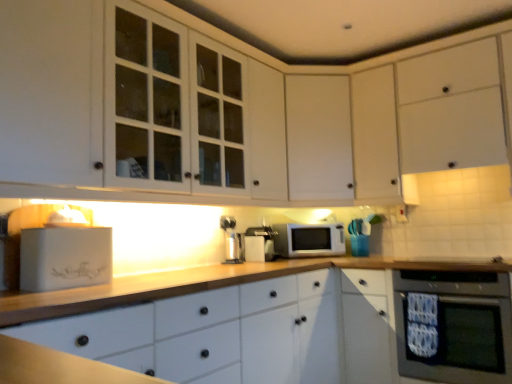
In order to click on satin silver coffee machine at center, which is the first coffee machine in left-to-right order in this screenshot , I will do `click(231, 240)`.

Where is `white glossy cabinet at upper left, which is counted as the first cabinetry, starting from the left`? This screenshot has width=512, height=384. white glossy cabinet at upper left, which is counted as the first cabinetry, starting from the left is located at coordinates (234, 112).

Locate an element on the screen. white matte cabinet at center, which is counted as the third cabinetry, starting from the left is located at coordinates (318, 137).

Where is `microwave oven behind the satin silver coffee machine at center, which is the second coffee machine in left-to-right order`? This screenshot has width=512, height=384. microwave oven behind the satin silver coffee machine at center, which is the second coffee machine in left-to-right order is located at coordinates point(309,240).

Which is less distant, (x=269, y=231) or (x=316, y=252)?

Positioned in front is point (x=316, y=252).

Is satin silver coffee machine at center, which is the second coffee machine in left-to-right order, not inside white matte microwave at center?

satin silver coffee machine at center, which is the second coffee machine in left-to-right order, is positioned outside white matte microwave at center.

Does satin silver coffee machine at center, which is the second coffee machine in left-to-right order, turn towards white matte microwave at center?

No, satin silver coffee machine at center, which is the second coffee machine in left-to-right order, is not turned towards white matte microwave at center.

Could black glass oven at lower right be considered to be inside satin silver coffee machine at center, the first coffee machine when ordered from right to left?

No, satin silver coffee machine at center, the first coffee machine when ordered from right to left, does not contain black glass oven at lower right.

From a real-world perspective, who is located higher, satin silver coffee machine at center, which is the second coffee machine in left-to-right order, or black glass oven at lower right?

satin silver coffee machine at center, which is the second coffee machine in left-to-right order, from a real-world perspective.

Which is nearer, (267,226) or (504,362)?

Point (267,226) is positioned farther from the camera compared to point (504,362).

From the image's perspective, is satin silver coffee machine at center, which is the second coffee machine in left-to-right order, located beneath black glass oven at lower right?

Incorrect, from the image's perspective, satin silver coffee machine at center, which is the second coffee machine in left-to-right order, is higher than black glass oven at lower right.

Is white matte cabinet at center, which is counted as the third cabinetry, starting from the left, beside white matte microwave at center?

white matte cabinet at center, which is counted as the third cabinetry, starting from the left, and white matte microwave at center are not in contact.

Which of these two, white matte cabinet at center, the 2th cabinetry from the right, or white matte microwave at center, is bigger?

Bigger between the two is white matte cabinet at center, the 2th cabinetry from the right.

Is white matte cabinet at center, which is counted as the third cabinetry, starting from the left, positioned with its back to white matte microwave at center?

white matte cabinet at center, which is counted as the third cabinetry, starting from the left, is not turned away from white matte microwave at center.

Is satin silver coffee machine at center, the first coffee machine when ordered from right to left, behind white matte cabinet at upper right, the fourth cabinetry in the left-to-right sequence?

Yes, satin silver coffee machine at center, the first coffee machine when ordered from right to left, is further from the viewer.

Considering the sizes of objects satin silver coffee machine at center, which is the second coffee machine in left-to-right order, and white matte cabinet at upper right, which is counted as the first cabinetry, starting from the right, in the image provided, who is wider, satin silver coffee machine at center, which is the second coffee machine in left-to-right order, or white matte cabinet at upper right, which is counted as the first cabinetry, starting from the right,?

white matte cabinet at upper right, which is counted as the first cabinetry, starting from the right.

What's the angular difference between white matte cabinet at center, the 2th cabinetry from the right, and white matte bread bin at left's facing directions?

There is a 48.1-degree angle between the facing directions of white matte cabinet at center, the 2th cabinetry from the right, and white matte bread bin at left.

Considering the sizes of objects white matte cabinet at center, the 2th cabinetry from the right, and white matte bread bin at left in the image provided, who is wider, white matte cabinet at center, the 2th cabinetry from the right, or white matte bread bin at left?

white matte cabinet at center, the 2th cabinetry from the right.

Is white matte cabinet at center, the 2th cabinetry from the right, aimed at white matte bread bin at left?

No.

Which is more to the left, white matte cabinet at center, the 2th cabinetry from the right, or white matte bread bin at left?

white matte bread bin at left is more to the left.

Which of these two, satin silver coffee machine at center, which is the second coffee machine in left-to-right order, or white matte cabinet at center, which is counted as the third cabinetry, starting from the left, is wider?

white matte cabinet at center, which is counted as the third cabinetry, starting from the left.

Which object is positioned more to the right, satin silver coffee machine at center, which is the second coffee machine in left-to-right order, or white matte cabinet at center, the 2th cabinetry from the right?

From the viewer's perspective, white matte cabinet at center, the 2th cabinetry from the right, appears more on the right side.

How distant is satin silver coffee machine at center, which is the second coffee machine in left-to-right order, from white matte cabinet at center, the 2th cabinetry from the right?

The distance of satin silver coffee machine at center, which is the second coffee machine in left-to-right order, from white matte cabinet at center, the 2th cabinetry from the right, is 26.77 inches.

Is satin silver coffee machine at center, which is the second coffee machine in left-to-right order, outside of white matte cabinet at center, the 2th cabinetry from the right?

Absolutely, satin silver coffee machine at center, which is the second coffee machine in left-to-right order, is external to white matte cabinet at center, the 2th cabinetry from the right.

Between white glossy cabinet at upper left, which ranks as the 4th cabinetry in right-to-left order, and white matte microwave at center, which one has less height?

Standing shorter between the two is white matte microwave at center.

Is white glossy cabinet at upper left, which is counted as the first cabinetry, starting from the left, positioned with its back to white matte microwave at center?

No, white matte microwave at center is not at the back of white glossy cabinet at upper left, which is counted as the first cabinetry, starting from the left.

Measure the distance between white glossy cabinet at upper left, which is counted as the first cabinetry, starting from the left, and white matte microwave at center.

The distance of white glossy cabinet at upper left, which is counted as the first cabinetry, starting from the left, from white matte microwave at center is 31.97 inches.

Which object is thinner, white glossy cabinet at upper left, which ranks as the 4th cabinetry in right-to-left order, or white matte microwave at center?

white matte microwave at center is thinner.

Locate an element on the screen. microwave oven on the right of satin silver coffee machine at center, which is the second coffee machine in left-to-right order is located at coordinates (309, 240).

Find the location of a particular element. The image size is (512, 384). home appliance below the satin silver coffee machine at center, the first coffee machine when ordered from right to left (from a real-world perspective) is located at coordinates (453, 326).

When comparing their distances from white matte bread bin at left, does satin silver coffee machine at center, arranged as the 2th coffee machine when viewed from the right, or white matte cabinet at upper right, the fourth cabinetry in the left-to-right sequence, seem further?

white matte cabinet at upper right, the fourth cabinetry in the left-to-right sequence.

From the image, which object appears to be farther from white plastic electric outlet at upper right, white matte bread bin at left or satin silver coffee machine at center, the first coffee machine when ordered from right to left?

white matte bread bin at left is further to white plastic electric outlet at upper right.

Looking at this image, estimate the real-world distances between objects in this image. Which object is further from white matte cabinet at upper right, which is counted as the first cabinetry, starting from the right, white matte bread bin at left or satin silver coffee machine at center, which is the second coffee machine in left-to-right order?

The object further to white matte cabinet at upper right, which is counted as the first cabinetry, starting from the right, is white matte bread bin at left.

Considering their positions, is black glass oven at lower right positioned further to white glossy cabinet at upper left, which ranks as the 4th cabinetry in right-to-left order, than white matte bread bin at left?

The object further to white glossy cabinet at upper left, which ranks as the 4th cabinetry in right-to-left order, is black glass oven at lower right.

When comparing their distances from white glossy cabinet at upper left, which is counted as the first cabinetry, starting from the left, does white matte cabinet at center, which is counted as the third cabinetry, starting from the left, or white matte cabinet at center, acting as the 2th cabinetry starting from the left, seem closer?

Based on the image, white matte cabinet at center, which is counted as the third cabinetry, starting from the left, appears to be nearer to white glossy cabinet at upper left, which is counted as the first cabinetry, starting from the left.

From the image, which object appears to be farther from black glass oven at lower right, white matte cabinet at center, acting as the 2th cabinetry starting from the left, or satin silver coffee machine at center, the first coffee machine when ordered from right to left?

satin silver coffee machine at center, the first coffee machine when ordered from right to left, lies further to black glass oven at lower right than the other object.

Considering their positions, is satin silver coffee machine at center, which is the second coffee machine in left-to-right order, positioned closer to white glossy cabinet at upper left, which ranks as the 4th cabinetry in right-to-left order, than white matte cabinet at center, marked as the 3th cabinetry in a right-to-left arrangement?

The object closer to white glossy cabinet at upper left, which ranks as the 4th cabinetry in right-to-left order, is white matte cabinet at center, marked as the 3th cabinetry in a right-to-left arrangement.

Estimate the real-world distances between objects in this image. Which object is closer to white plastic electric outlet at upper right, white glossy cabinet at upper left, which is counted as the first cabinetry, starting from the left, or black glass oven at lower right?

Based on the image, black glass oven at lower right appears to be nearer to white plastic electric outlet at upper right.

At what (x,y) coordinates should I click in order to perform the action: click on electric outlet located between satin silver coffee machine at center, arranged as the 2th coffee machine when viewed from the right, and black glass oven at lower right in the left-right direction. Please return your answer as a coordinate pair (x, y). Image resolution: width=512 pixels, height=384 pixels. Looking at the image, I should click on (401, 213).

Identify the location of cabinetry between white matte microwave at center and white matte cabinet at upper right, which is counted as the first cabinetry, starting from the right, from left to right. The height and width of the screenshot is (384, 512). (318, 137).

The height and width of the screenshot is (384, 512). Identify the location of appliance between white glossy cabinet at upper left, which is counted as the first cabinetry, starting from the left, and white matte cabinet at center, marked as the 3th cabinetry in a right-to-left arrangement, from top to bottom. (65, 258).

Identify the location of electric outlet between white matte cabinet at center, which is counted as the third cabinetry, starting from the left, and white matte cabinet at upper right, which is counted as the first cabinetry, starting from the right. (401, 213).